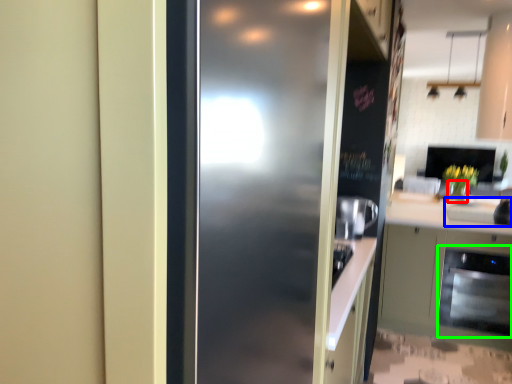
Question: Based on their relative distances, which object is nearer to vase (highlighted by a red box)? Choose from sink (highlighted by a blue box) and dish washer (highlighted by a green box).

Choices:
 (A) sink
 (B) dish washer

Answer: (A)